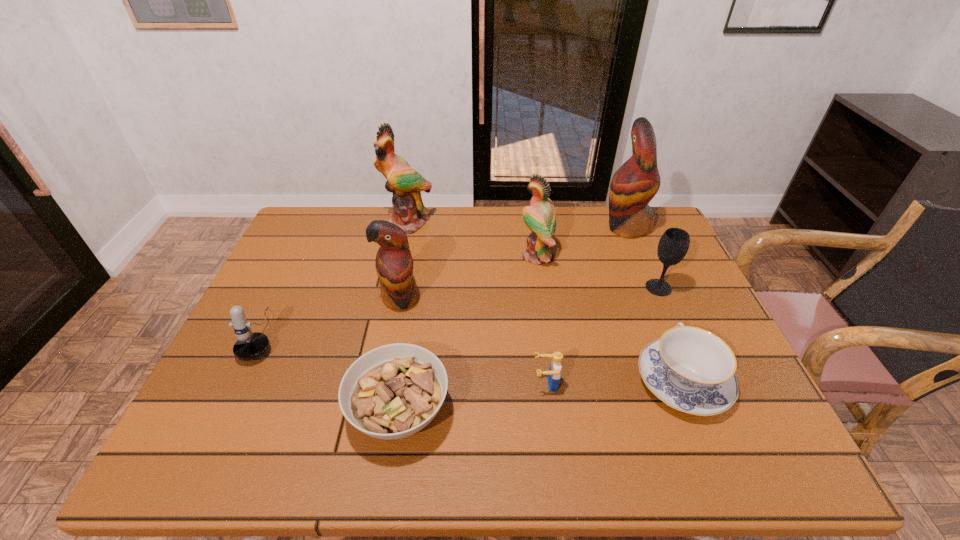
The image size is (960, 540). In order to click on the fourth shortest object in this screenshot , I will do `click(249, 346)`.

You are a GUI agent. You are given a task and a screenshot of the screen. Output one action in this format:
    pyautogui.click(x=<x>, y=<y>)
    Task: Click on the blue Lego
    This screenshot has width=960, height=540.
    Given the screenshot: What is the action you would take?
    pyautogui.click(x=553, y=376)

This screenshot has height=540, width=960. Find the location of `chinaware`. chinaware is located at coordinates (690, 369).

Find the location of a particular element. This screenshot has height=540, width=960. stew is located at coordinates (391, 392).

Find the location of a particular element. This screenshot has height=540, width=960. vacant space situated on the face of the right red parrot is located at coordinates (485, 227).

Where is `free region located 0.050m on the face of the right red parrot`? free region located 0.050m on the face of the right red parrot is located at coordinates (587, 227).

Locate an element on the screen. This screenshot has height=540, width=960. vacant space located on the face of the right red parrot is located at coordinates (554, 227).

You are a GUI agent. You are given a task and a screenshot of the screen. Output one action in this format:
    pyautogui.click(x=<x>, y=<y>)
    Task: Click on the vacant region located 0.260m on the front-facing side of the left green parrot
    This screenshot has width=960, height=540.
    Given the screenshot: What is the action you would take?
    pyautogui.click(x=394, y=292)

Find the location of a particular element. free space located 0.240m on the front-facing side of the smaller green parrot is located at coordinates 442,256.

The height and width of the screenshot is (540, 960). I want to click on free space located on the front-facing side of the smaller green parrot, so click(x=432, y=256).